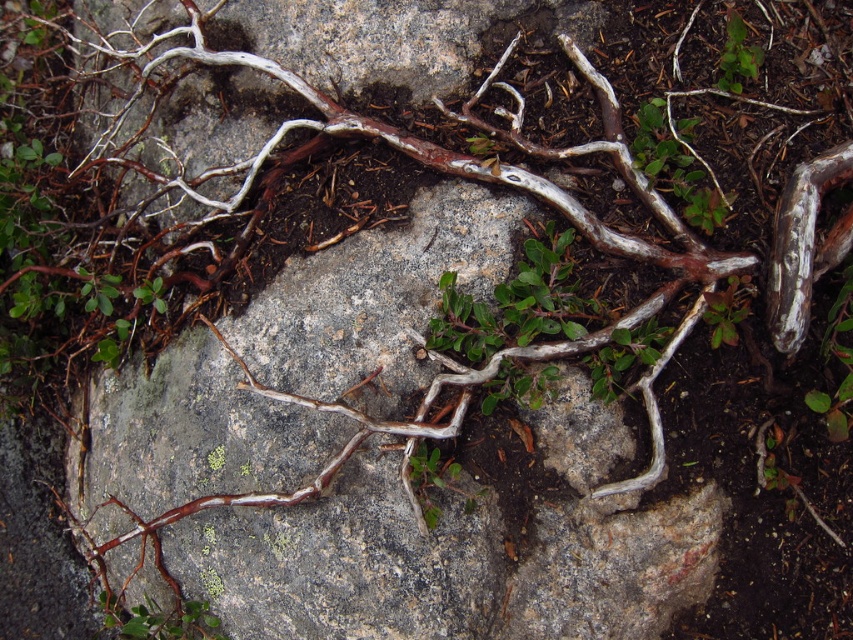
Identify the location of green matte plant at lower left. Image resolution: width=853 pixels, height=640 pixels. (160, 620).